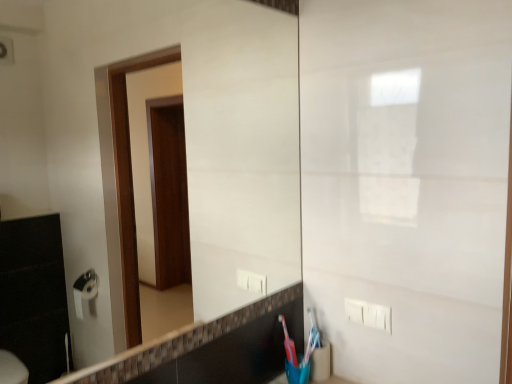
Question: Is translucent plastic toothbrush at lower right to the right of white plastic electric outlet at lower right from the viewer's perspective?

Choices:
 (A) yes
 (B) no

Answer: (B)

Question: Considering the relative sizes of translucent plastic toothbrush at lower right and white plastic electric outlet at lower right in the image provided, is translucent plastic toothbrush at lower right wider than white plastic electric outlet at lower right?

Choices:
 (A) no
 (B) yes

Answer: (B)

Question: Does translucent plastic toothbrush at lower right have a lesser width compared to white plastic electric outlet at lower right?

Choices:
 (A) no
 (B) yes

Answer: (A)

Question: Considering the relative positions of translucent plastic toothbrush at lower right and white plastic electric outlet at lower right in the image provided, is translucent plastic toothbrush at lower right to the left of white plastic electric outlet at lower right from the viewer's perspective?

Choices:
 (A) no
 (B) yes

Answer: (B)

Question: Is translucent plastic toothbrush at lower right smaller than white plastic electric outlet at lower right?

Choices:
 (A) no
 (B) yes

Answer: (B)

Question: Is translucent plastic toothbrush at lower right behind white plastic electric outlet at lower right?

Choices:
 (A) yes
 (B) no

Answer: (A)

Question: Is white plastic electric outlet at lower right positioned in front of translucent plastic toothbrush at lower right?

Choices:
 (A) no
 (B) yes

Answer: (B)

Question: Is white plastic electric outlet at lower right located outside translucent plastic toothbrush at lower right?

Choices:
 (A) no
 (B) yes

Answer: (B)

Question: From the image's perspective, is white plastic electric outlet at lower right beneath translucent plastic toothbrush at lower right?

Choices:
 (A) yes
 (B) no

Answer: (B)

Question: Does white plastic electric outlet at lower right have a smaller size compared to translucent plastic toothbrush at lower right?

Choices:
 (A) yes
 (B) no

Answer: (B)

Question: Is white plastic electric outlet at lower right bigger than translucent plastic toothbrush at lower right?

Choices:
 (A) yes
 (B) no

Answer: (A)

Question: Is white plastic electric outlet at lower right in contact with translucent plastic toothbrush at lower right?

Choices:
 (A) no
 (B) yes

Answer: (A)

Question: Is white plastic electric outlet at lower right spatially inside translucent plastic toothbrush at lower right, or outside of it?

Choices:
 (A) inside
 (B) outside

Answer: (B)